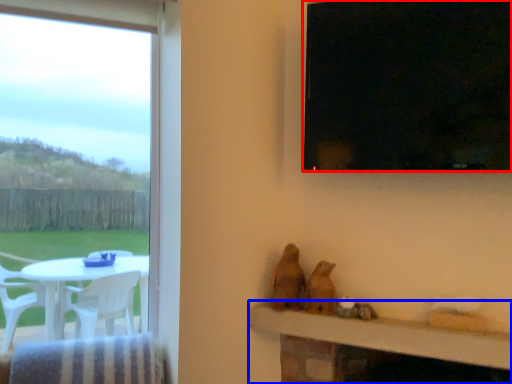
Question: Among these objects, which one is nearest to the camera, window (highlighted by a red box) or table (highlighted by a blue box)?

Choices:
 (A) window
 (B) table

Answer: (A)